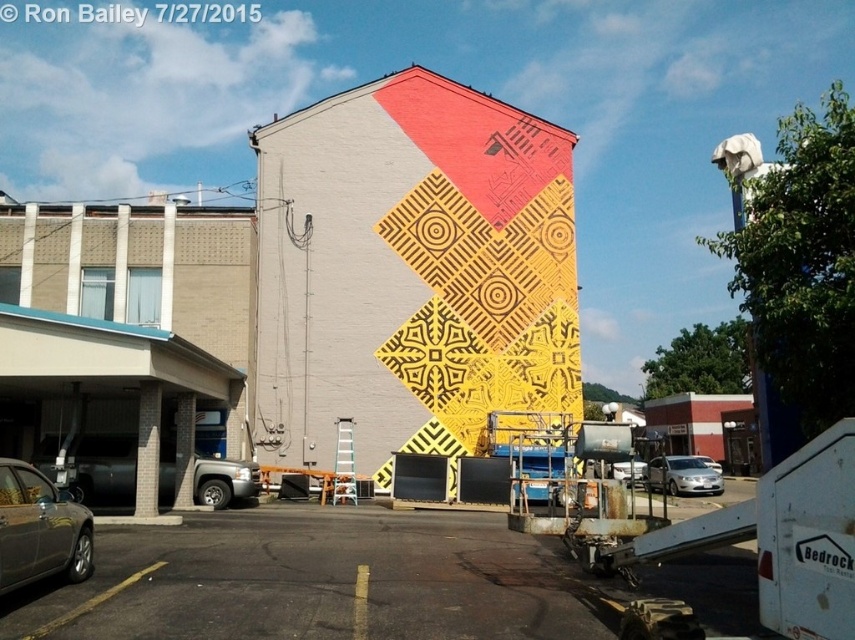
You are a parking attendant who needs to fit a third car into the space between the metallic gray sedan at lower left and the silver metallic sedan at center. The third car is 4.5 meters long. Can you determine if there is enough space between them?

The metallic gray sedan at lower left is shorter than the silver metallic sedan at center, but without knowing the exact distance between them, it is impossible to determine if the 4.5 meter car will fit. Additional measurements are required.